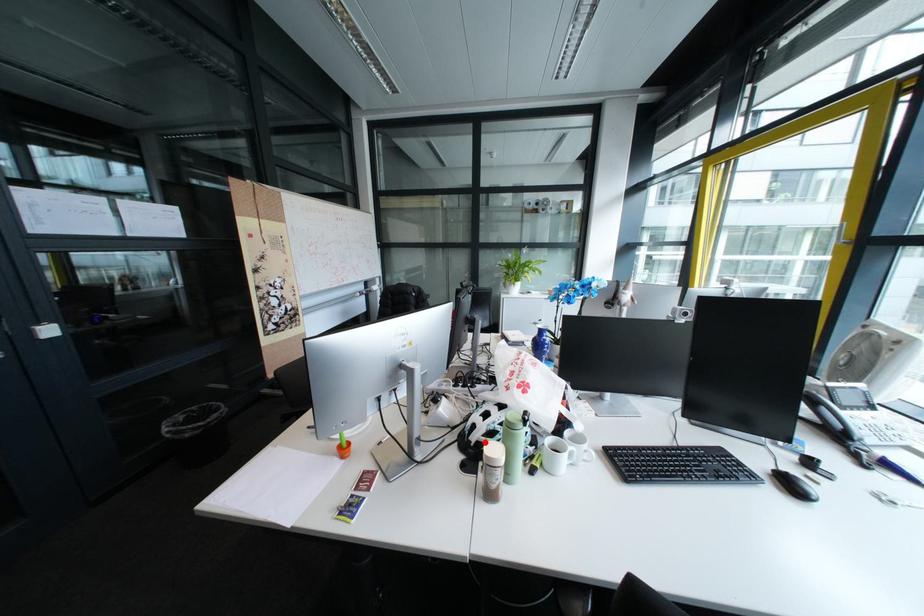
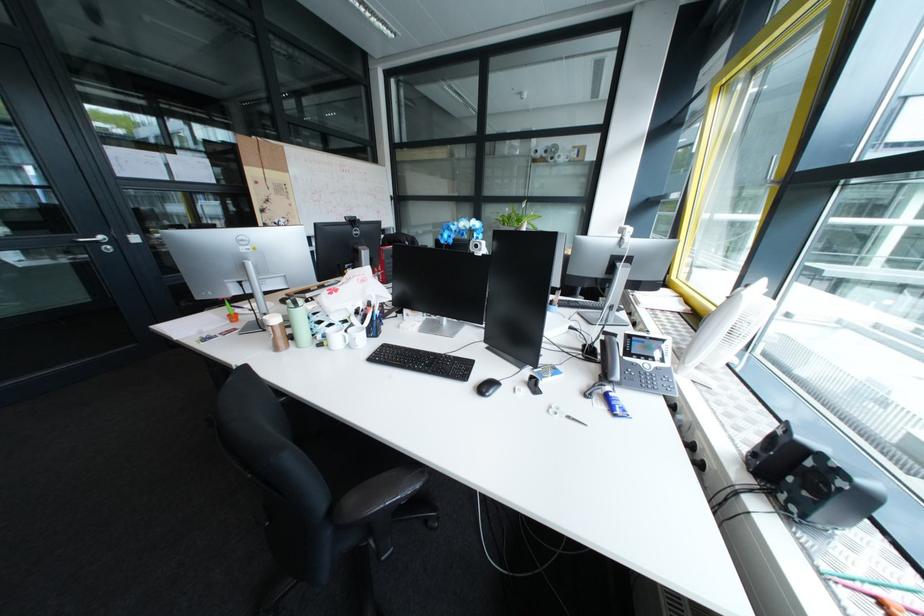
Question: I am providing you with two images of the same scene from different viewpoints. A red point is marked on the first image. Can you still see the location of the red point in image 2?

Choices:
 (A) Yes
 (B) No

Answer: (B)